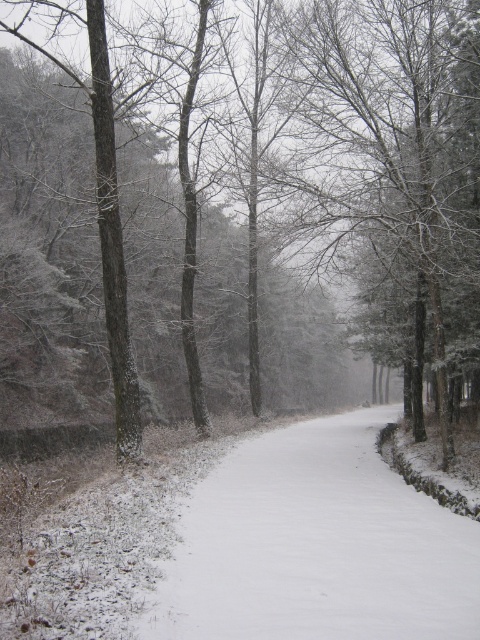
Is point (302, 12) more distant than point (456, 604)?

Yes, point (302, 12) is behind point (456, 604).

Is white snow-covered tree at center above white snow-covered path at center?

Yes, white snow-covered tree at center is above white snow-covered path at center.

Is point (303, 163) positioned behind point (273, 486)?

Yes, point (303, 163) is farther from viewer.

Locate an element on the screen. The width and height of the screenshot is (480, 640). white snow-covered tree at center is located at coordinates (382, 154).